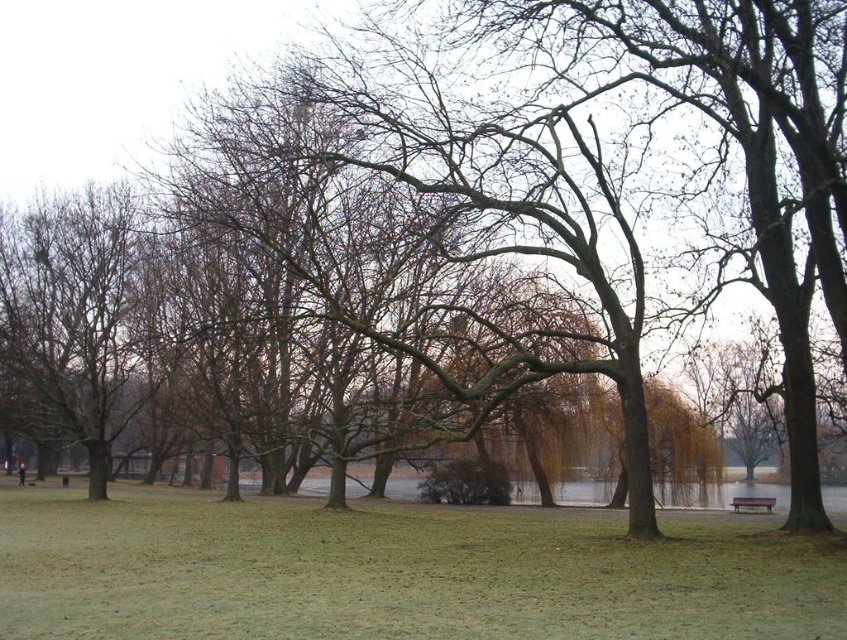
You are standing at the lower right corner of the image and want to sit on the wooden bench at lower right. However, there is a patch of green grassy at center in your path. Can you walk directly to the bench without stepping on the grass?

The green grassy at center is located above the wooden bench at lower right, meaning it is closer to the top of the image. Since you are starting from the lower right corner, your path to the bench would not cross the grassy area. You can walk directly to the wooden bench at lower right without stepping on the green grassy at center.

You are standing in the park and want to sit on the wooden bench at lower right. From your current position at the green grassy at center, which direction should you move to reach the bench?

Since the green grassy at center is closer to the viewer than the wooden bench at lower right, you should move forward towards the bench, as it is located further away from your current position.